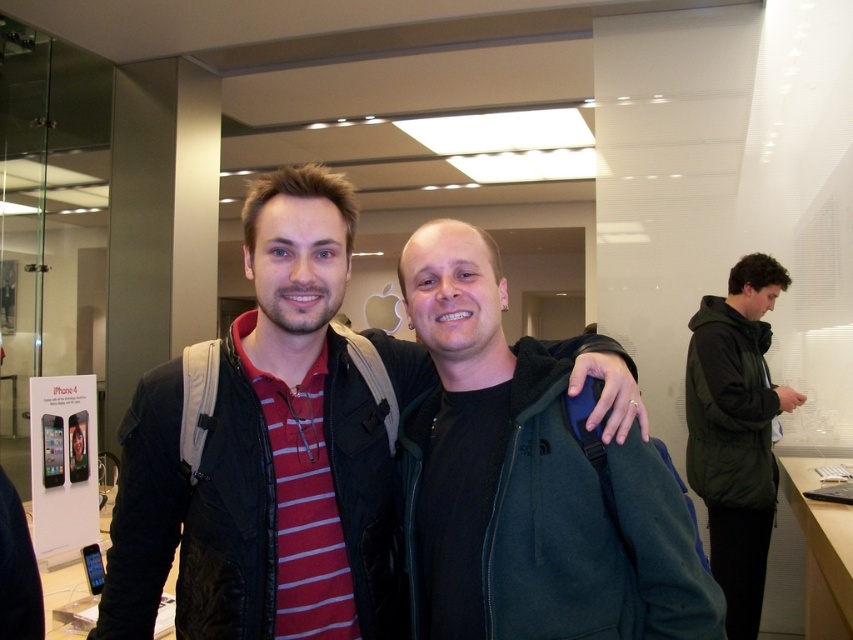
Locate an element on the screen. matte black jacket at center is located at coordinates tap(265, 456).

Is matte black jacket at center to the right of green matte jacket at right from the viewer's perspective?

No, matte black jacket at center is not to the right of green matte jacket at right.

Who is more forward, [148,529] or [718,516]?

Point [148,529] is more forward.

I want to click on matte black jacket at center, so click(x=265, y=456).

Does matte black jacket at center appear under green fleece jacket at center?

Incorrect, matte black jacket at center is not positioned below green fleece jacket at center.

Who is more forward, (416, 348) or (509, 588)?

Point (509, 588) is in front.

Who is more forward, (300,420) or (468,332)?

Point (468,332)

Locate an element on the screen. The width and height of the screenshot is (853, 640). matte black jacket at center is located at coordinates (265, 456).

Is green fleece jacket at center to the left of green matte jacket at right from the viewer's perspective?

Indeed, green fleece jacket at center is positioned on the left side of green matte jacket at right.

In the scene shown: Which is above, green fleece jacket at center or green matte jacket at right?

green fleece jacket at center is higher up.

Locate an element on the screen. Image resolution: width=853 pixels, height=640 pixels. green fleece jacket at center is located at coordinates (529, 481).

Identify the location of green fleece jacket at center. (529, 481).